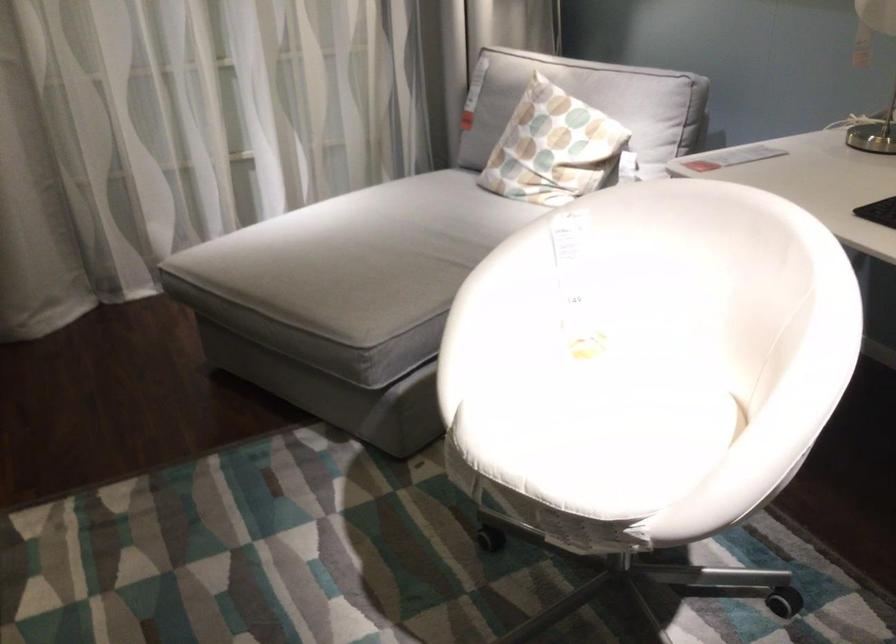
The location [553,147] corresponds to which object?

It corresponds to the patterned pillow in the image.